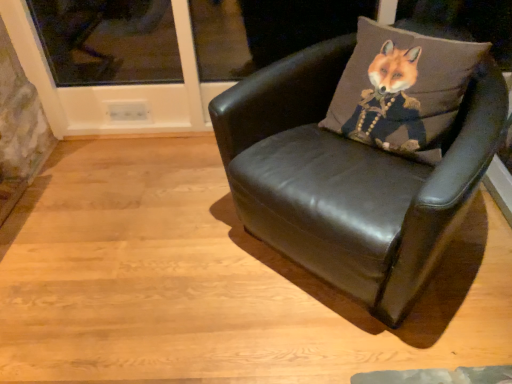
Question: Would you say brown fabric fox at upper right is to the left or to the right of black leather chair at center in the picture?

Choices:
 (A) right
 (B) left

Answer: (A)

Question: Considering their positions, is brown fabric fox at upper right located in front of or behind black leather chair at center?

Choices:
 (A) front
 (B) behind

Answer: (B)

Question: Does point (373, 56) appear closer or farther from the camera than point (279, 91)?

Choices:
 (A) farther
 (B) closer

Answer: (B)

Question: Is black leather chair at center to the left or to the right of brown fabric fox at upper right in the image?

Choices:
 (A) left
 (B) right

Answer: (A)

Question: From their relative heights in the image, would you say black leather chair at center is taller or shorter than brown fabric fox at upper right?

Choices:
 (A) tall
 (B) short

Answer: (A)

Question: Relative to brown fabric fox at upper right, is black leather chair at center in front or behind?

Choices:
 (A) behind
 (B) front

Answer: (B)

Question: Does point (222, 150) appear closer or farther from the camera than point (440, 34)?

Choices:
 (A) farther
 (B) closer

Answer: (B)